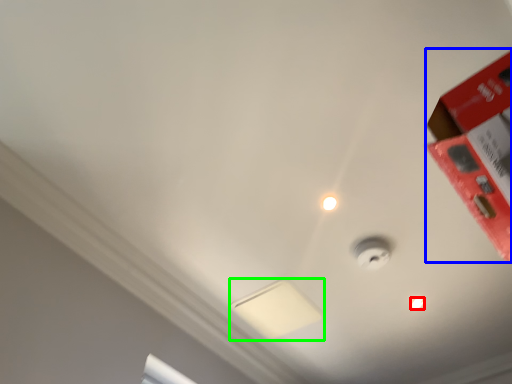
Question: Based on their relative distances, which object is nearer to light bulb (highlighted by a red box)? Choose from box (highlighted by a blue box) and lamp (highlighted by a green box).

Choices:
 (A) box
 (B) lamp

Answer: (B)